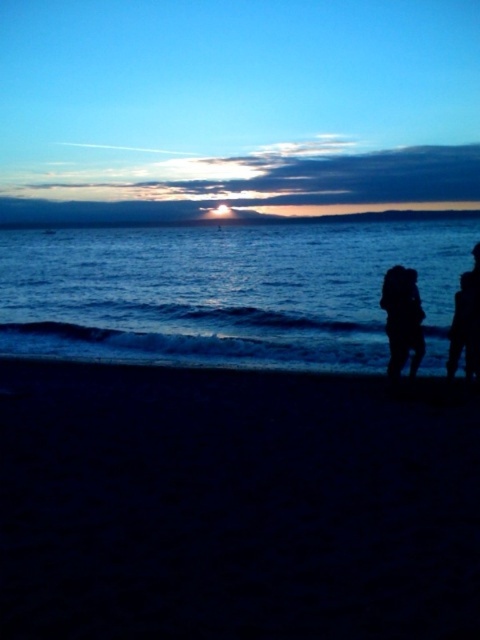
Is silhouette couple at right smaller than black matte figure at lower right?

No.

Does silhouette couple at right lie in front of black matte figure at lower right?

Yes, silhouette couple at right is closer to the viewer.

Measure the distance between point (471, 316) and camera.

The distance of point (471, 316) from camera is 10.82 meters.

In order to click on silhouette couple at right in this screenshot , I will do `click(404, 316)`.

Can you confirm if blue water at center is bigger than blue matte horizon at upper center?

Correct, blue water at center is larger in size than blue matte horizon at upper center.

Between blue water at center and blue matte horizon at upper center, which one is positioned higher?

blue matte horizon at upper center

Which is behind, point (7, 291) or point (132, 212)?

The point (132, 212) is behind.

Identify the location of blue water at center. (227, 291).

Between point (192, 340) and point (384, 289), which one is positioned in front?

Point (384, 289) is in front.

Is point (218, 289) less distant than point (396, 308)?

That is False.

Who is more distant from viewer, (447, 273) or (417, 362)?

Point (447, 273)

What are the coordinates of `blue water at center` in the screenshot? It's located at (227, 291).